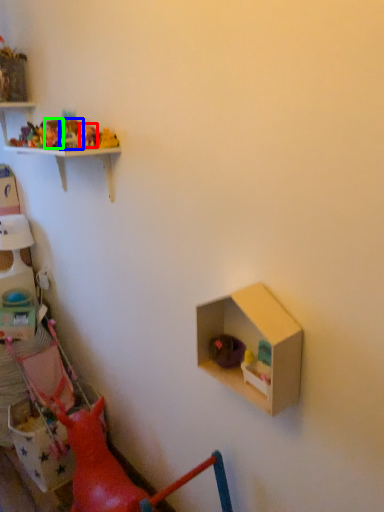
Question: Based on their relative distances, which object is nearer to toy (highlighted by a red box)? Choose from toy (highlighted by a blue box) and toy (highlighted by a green box).

Choices:
 (A) toy
 (B) toy

Answer: (A)